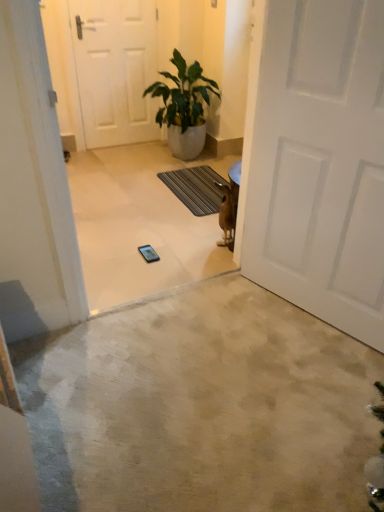
Question: Is white matte door at center, which appears as the second door when viewed from the back, in front of dark gray textured mat at center?

Choices:
 (A) yes
 (B) no

Answer: (A)

Question: Does white matte door at center, marked as the first door in a right-to-left arrangement, have a larger size compared to dark gray textured mat at center?

Choices:
 (A) yes
 (B) no

Answer: (A)

Question: Is white matte door at center, marked as the 1th door in a front-to-back arrangement, touching dark gray textured mat at center?

Choices:
 (A) no
 (B) yes

Answer: (A)

Question: Does white matte door at center, which is the first door from bottom to top, have a lesser height compared to dark gray textured mat at center?

Choices:
 (A) yes
 (B) no

Answer: (B)

Question: Does white matte door at center, which appears as the second door when viewed from the back, appear on the right side of dark gray textured mat at center?

Choices:
 (A) no
 (B) yes

Answer: (B)

Question: Looking at their shapes, would you say white matte door at upper center, the 2th door from the front, is wider or thinner than green glossy plant at center?

Choices:
 (A) wide
 (B) thin

Answer: (B)

Question: Choose the correct answer: Is white matte door at upper center, arranged as the 2th door when viewed from the right, inside green glossy plant at center or outside it?

Choices:
 (A) inside
 (B) outside

Answer: (B)

Question: Would you say white matte door at upper center, the 1th door viewed from the top, is to the left or to the right of green glossy plant at center in the picture?

Choices:
 (A) right
 (B) left

Answer: (B)

Question: From a real-world perspective, is white matte door at upper center, arranged as the 2th door when viewed from the right, positioned above or below green glossy plant at center?

Choices:
 (A) above
 (B) below

Answer: (A)

Question: Considering the relative positions of beige carpet at center and green glossy plant at center in the image provided, is beige carpet at center to the left or to the right of green glossy plant at center?

Choices:
 (A) left
 (B) right

Answer: (B)

Question: From a real-world perspective, is beige carpet at center above or below green glossy plant at center?

Choices:
 (A) below
 (B) above

Answer: (A)

Question: Is beige carpet at center bigger or smaller than green glossy plant at center?

Choices:
 (A) small
 (B) big

Answer: (A)

Question: Do you think beige carpet at center is within green glossy plant at center, or outside of it?

Choices:
 (A) inside
 (B) outside

Answer: (B)

Question: Relative to beige carpet at center, is dark gray textured mat at center in front or behind?

Choices:
 (A) behind
 (B) front

Answer: (A)

Question: In terms of height, does dark gray textured mat at center look taller or shorter compared to beige carpet at center?

Choices:
 (A) short
 (B) tall

Answer: (B)